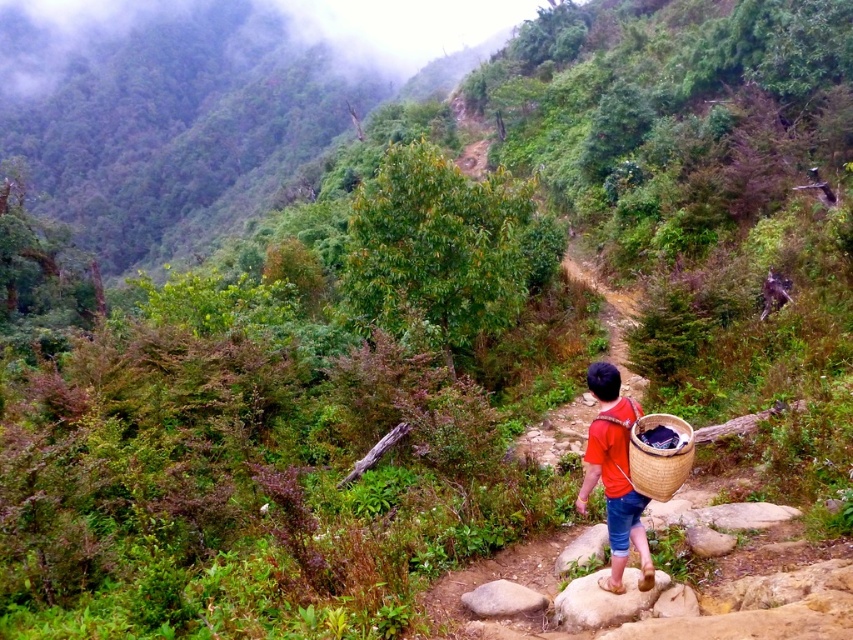
You are a hiker who just found two baskets in the forest. The red woven basket at center and the woven bamboo basket at lower right. You need to place them 14 inches apart for a photo. Can you adjust their positions to meet the requirement?

The red woven basket at center and the woven bamboo basket at lower right are currently 12.75 inches apart. To meet the 14 inches requirement, you need to move them 1.25 inches farther apart.

You are a hiker trying to carry your woven bamboo basket at lower right and a smooth gray rock at center. If you want to place both items on the same shelf, which one requires a wider shelf space?

The smooth gray rock at center requires a wider shelf space because its width is greater than the woven bamboo basket at lower right.

You are a hiker carrying a red woven basket at center and a smooth gray rock at center. You need to place them in order from left to right. Which object should be placed first?

The smooth gray rock at center should be placed first because the red woven basket at center is positioned on the right side of it.